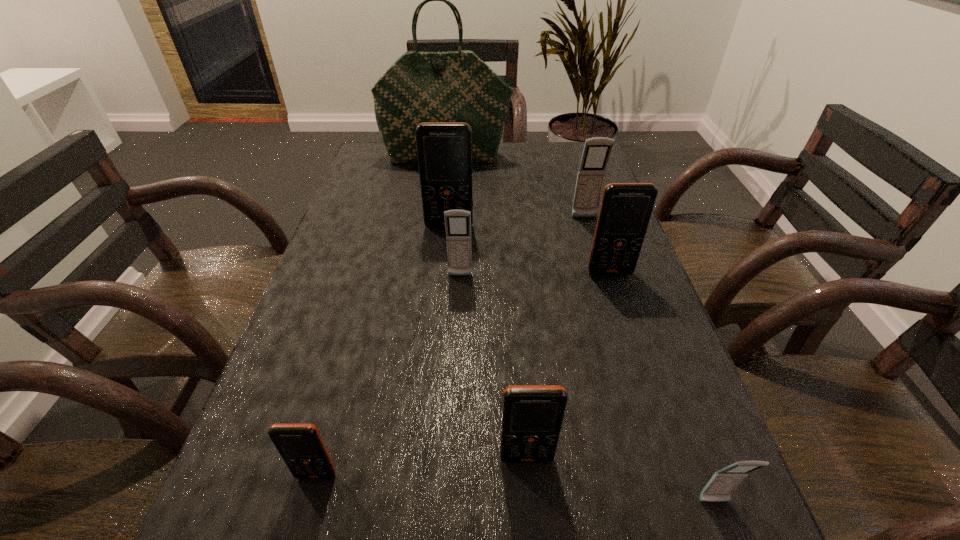
Where is `the second orange cellular telephone from right to left`? the second orange cellular telephone from right to left is located at coordinates (532, 416).

The width and height of the screenshot is (960, 540). What are the coordinates of `the third biggest orange cellular telephone` in the screenshot? It's located at (532, 416).

You are a GUI agent. You are given a task and a screenshot of the screen. Output one action in this format:
    pyautogui.click(x=<x>, y=<y>)
    Task: Click on the second nearest cellular telephone
    This screenshot has height=540, width=960.
    Given the screenshot: What is the action you would take?
    tap(301, 446)

You are a GUI agent. You are given a task and a screenshot of the screen. Output one action in this format:
    pyautogui.click(x=<x>, y=<y>)
    Task: Click on the nearest orange cellular telephone
    This screenshot has width=960, height=540.
    Given the screenshot: What is the action you would take?
    [301, 446]

Where is `the nearest cellular telephone`? the nearest cellular telephone is located at coordinates (719, 488).

At what (x,y) coordinates should I click in order to perform the action: click on the rightmost gray cellular telephone. Please return your answer as a coordinate pair (x, y). The height and width of the screenshot is (540, 960). Looking at the image, I should click on (719, 488).

Where is `vacant area situated on the front of the farthest object`? Image resolution: width=960 pixels, height=540 pixels. vacant area situated on the front of the farthest object is located at coordinates (443, 185).

Locate an element on the screen. free space located on the screen of the farthest orange cellular telephone is located at coordinates (441, 327).

Identify the location of vacant region located on the front-facing side of the second farthest object. The image size is (960, 540). (613, 312).

Image resolution: width=960 pixels, height=540 pixels. What are the coordinates of `vacant space situated on the screen of the rightmost orange cellular telephone` in the screenshot? It's located at (652, 400).